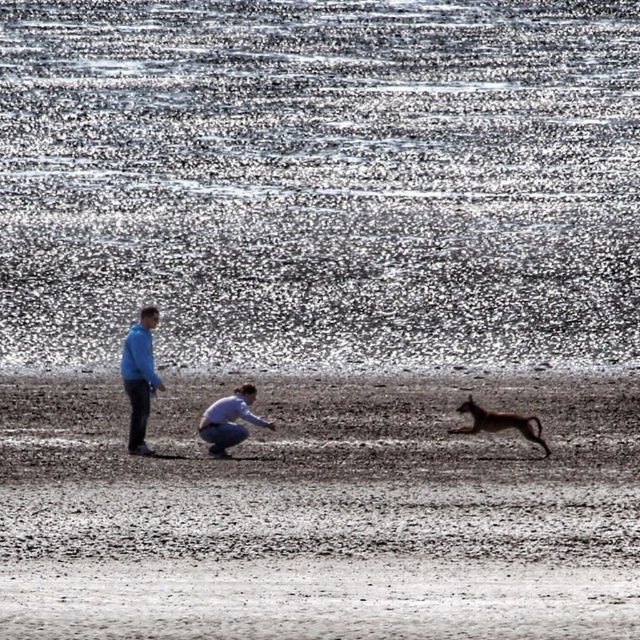
Question: Does brown sandy beach at center have a smaller size compared to brown furry dog at right?

Choices:
 (A) no
 (B) yes

Answer: (A)

Question: Which is nearer to the blue fabric man at left?

Choices:
 (A) brown furry dog at right
 (B) brown sandy beach at center
 (C) light blue fabric squat at center

Answer: (C)

Question: Does blue fabric man at left have a larger size compared to light blue fabric squat at center?

Choices:
 (A) yes
 (B) no

Answer: (B)

Question: Which object is closer to the camera taking this photo?

Choices:
 (A) brown furry dog at right
 (B) blue fabric man at left
 (C) brown sandy beach at center
 (D) light blue fabric squat at center

Answer: (C)

Question: Does brown sandy beach at center have a smaller size compared to blue fabric man at left?

Choices:
 (A) no
 (B) yes

Answer: (A)

Question: Estimate the real-world distances between objects in this image. Which object is farther from the brown sandy beach at center?

Choices:
 (A) blue fabric man at left
 (B) light blue fabric squat at center
 (C) brown furry dog at right

Answer: (A)